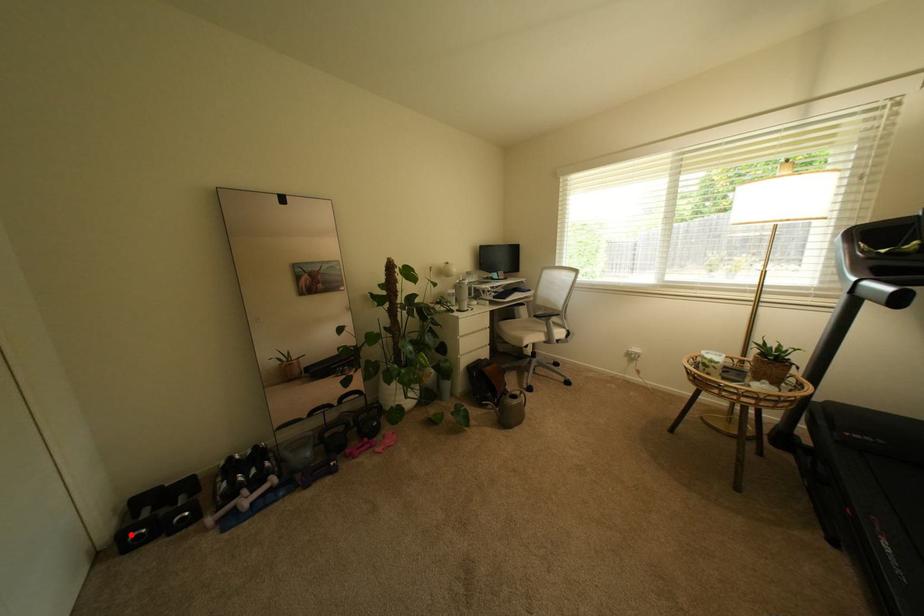
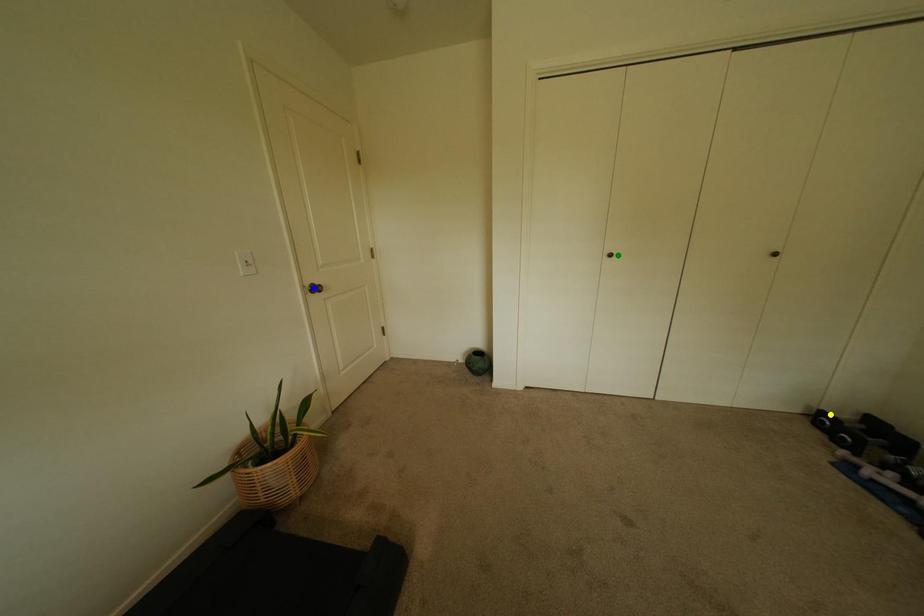
Question: I am providing you with two images of the same scene from different viewpoints. A red point is marked on the first image. You are given multiple points on the second image. Can you choose the point in image 2 that corresponds to the point in image 1?

Choices:
 (A) blue point
 (B) yellow point
 (C) green point

Answer: (B)